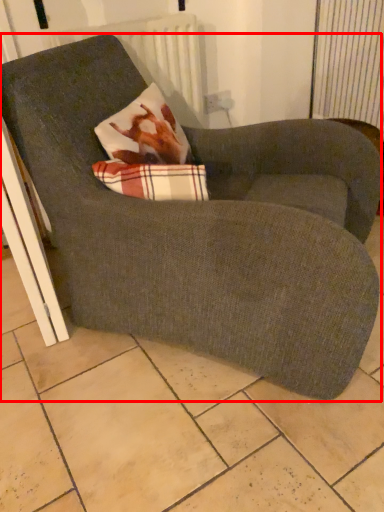
Question: From the image's perspective, what is the correct spatial positioning of chair (annotated by the red box) in reference to radiator?

Choices:
 (A) below
 (B) above

Answer: (A)